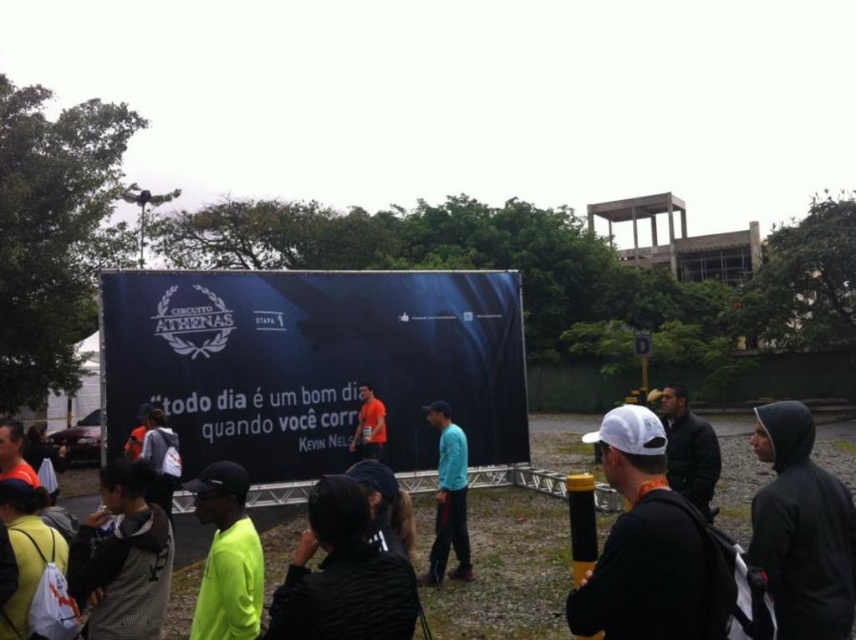
Is black fabric at center shorter than teal matte shirt at center?

Correct, black fabric at center is not as tall as teal matte shirt at center.

Which is behind, point (367, 624) or point (446, 499)?

The point (446, 499) is behind.

The height and width of the screenshot is (640, 856). What are the coordinates of `black fabric at center` in the screenshot? It's located at (342, 576).

Does teal matte shirt at center have a lesser height compared to matte black backpack at center?

No, teal matte shirt at center is not shorter than matte black backpack at center.

Is point (455, 460) positioned in front of point (170, 496)?

Yes, point (455, 460) is closer to viewer.

Who is more distant from viewer, (456, 477) or (174, 438)?

The point (174, 438) is behind.

The image size is (856, 640). I want to click on teal matte shirt at center, so click(449, 499).

Which is behind, point (646, 461) or point (358, 413)?

Positioned behind is point (358, 413).

The image size is (856, 640). In order to click on white matte cap at center in this screenshot , I will do `click(646, 547)`.